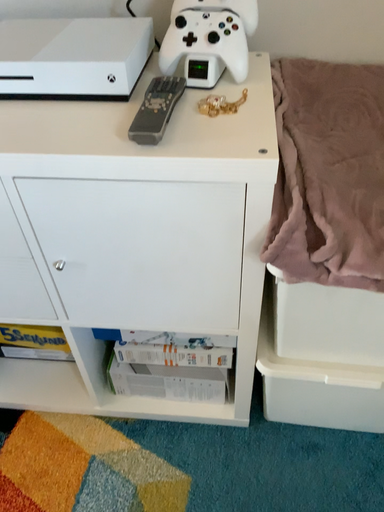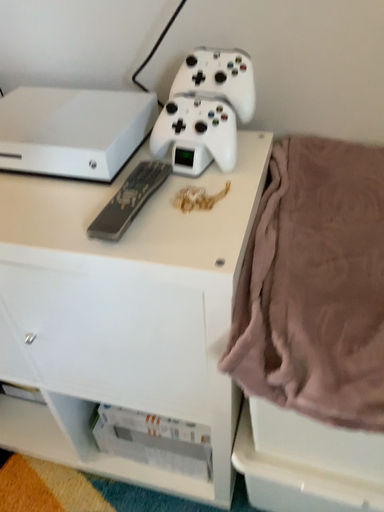
Question: Which way did the camera rotate in the video?

Choices:
 (A) rotated left
 (B) rotated right

Answer: (A)